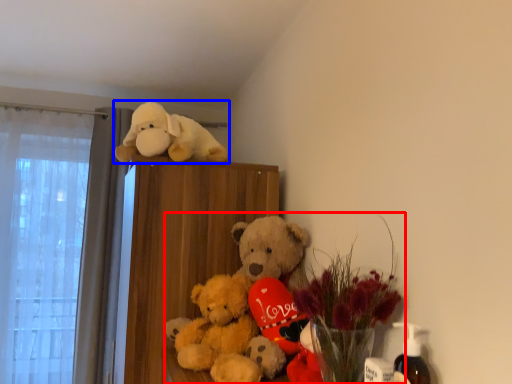
Question: Which of the following is the closest to the observer, floral arrangement (highlighted by a red box) or toy (highlighted by a blue box)?

Choices:
 (A) floral arrangement
 (B) toy

Answer: (A)